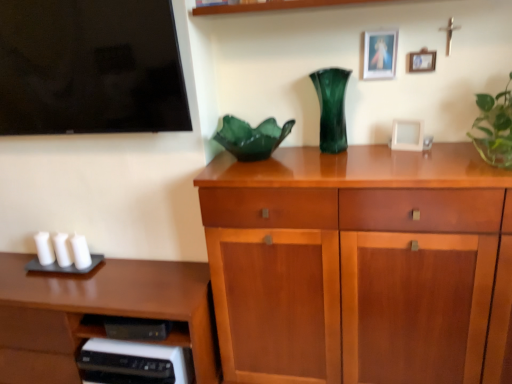
This screenshot has height=384, width=512. Identify the location of free space between green glossy plant at right, arranged as the 1th houseplant when viewed from the right, and green glass vase at center. (413, 155).